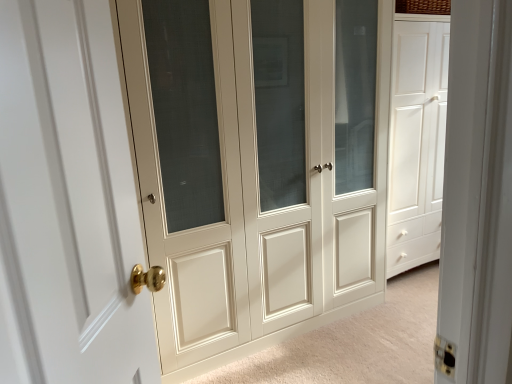
What is the approximate height of white glossy door at left, the 2th door viewed from the back?

white glossy door at left, the 2th door viewed from the back, is 95.21 centimeters in height.

Measure the distance between point (53, 136) and camera.

Point (53, 136) and camera are 25.43 inches apart.

What do you see at coordinates (67, 201) in the screenshot?
I see `white glossy door at left, marked as the first door in a front-to-back arrangement` at bounding box center [67, 201].

Where is `white glossy door at left, marked as the first door in a front-to-back arrangement`? white glossy door at left, marked as the first door in a front-to-back arrangement is located at coordinates (67, 201).

Describe the element at coordinates (258, 161) in the screenshot. Image resolution: width=512 pixels, height=384 pixels. I see `matte cream cabinet at center, which is the first door from back to front` at that location.

At what (x,y) coordinates should I click in order to perform the action: click on matte cream cabinet at center, which is the 1th door in right-to-left order. Please return your answer as a coordinate pair (x, y). Image resolution: width=512 pixels, height=384 pixels. Looking at the image, I should click on (258, 161).

Identify the location of white glossy door at left, marked as the first door in a front-to-back arrangement. (67, 201).

Is matte cream cabinet at center, the second door when ordered from left to right, at the left side of white glossy door at left, marked as the first door in a front-to-back arrangement?

No.

Which object is further away from the camera, matte cream cabinet at center, which is the second door from front to back, or white glossy door at left, which ranks as the 1th door in left-to-right order?

matte cream cabinet at center, which is the second door from front to back, is behind.

Is point (240, 157) closer or farther from the camera than point (110, 128)?

Point (240, 157) is positioned farther from the camera compared to point (110, 128).

In the scene shown: From the image's perspective, which is below, matte cream cabinet at center, which is the 1th door in right-to-left order, or white glossy door at left, acting as the second door starting from the right?

white glossy door at left, acting as the second door starting from the right, from the image's perspective.

From a real-world perspective, which object stands above the other?

In real-world perspective, white glossy door at left, acting as the second door starting from the right, is above.

Which of these two, matte cream cabinet at center, the second door when ordered from left to right, or white glossy door at left, the 2th door viewed from the back, is thinner?

With smaller width is white glossy door at left, the 2th door viewed from the back.

Who is shorter, matte cream cabinet at center, which is the first door from back to front, or white glossy door at left, acting as the second door starting from the right?

white glossy door at left, acting as the second door starting from the right.

Considering the sizes of matte cream cabinet at center, which is the first door from back to front, and white glossy door at left, marked as the first door in a front-to-back arrangement, in the image, is matte cream cabinet at center, which is the first door from back to front, bigger or smaller than white glossy door at left, marked as the first door in a front-to-back arrangement,?

In the image, matte cream cabinet at center, which is the first door from back to front, appears to be larger than white glossy door at left, marked as the first door in a front-to-back arrangement.

Do you think matte cream cabinet at center, which is the second door from front to back, is within white glossy door at left, marked as the first door in a front-to-back arrangement, or outside of it?

matte cream cabinet at center, which is the second door from front to back, cannot be found inside white glossy door at left, marked as the first door in a front-to-back arrangement.

Is matte cream cabinet at center, which is the 1th door in right-to-left order, not close to white glossy door at left, marked as the first door in a front-to-back arrangement?

Yes.

Looking at this image, is matte cream cabinet at center, the second door when ordered from left to right, oriented towards white glossy door at left, the 2th door viewed from the back?

Yes, matte cream cabinet at center, the second door when ordered from left to right, is turned towards white glossy door at left, the 2th door viewed from the back.

Can you tell me how much matte cream cabinet at center, which is the second door from front to back, and white glossy door at left, which ranks as the 1th door in left-to-right order, differ in facing direction?

56.3 degrees separate the facing orientations of matte cream cabinet at center, which is the second door from front to back, and white glossy door at left, which ranks as the 1th door in left-to-right order.

You are a GUI agent. You are given a task and a screenshot of the screen. Output one action in this format:
    pyautogui.click(x=<x>, y=<y>)
    Task: Click on the door that appears above the matte cream cabinet at center, the second door when ordered from left to right (from a real-world perspective)
    
    Given the screenshot: What is the action you would take?
    pyautogui.click(x=67, y=201)

Which is more to the right, white glossy door at left, which ranks as the 1th door in left-to-right order, or matte cream cabinet at center, the second door when ordered from left to right?

Positioned to the right is matte cream cabinet at center, the second door when ordered from left to right.

Between white glossy door at left, the 2th door viewed from the back, and matte cream cabinet at center, which is the 1th door in right-to-left order, which one is positioned in front?

white glossy door at left, the 2th door viewed from the back, is in front.

Is point (105, 326) closer to camera compared to point (140, 105)?

That is True.

From the image's perspective, is white glossy door at left, which ranks as the 1th door in left-to-right order, located above or below matte cream cabinet at center, which is the first door from back to front?

white glossy door at left, which ranks as the 1th door in left-to-right order, is below matte cream cabinet at center, which is the first door from back to front.

From a real-world perspective, is white glossy door at left, which ranks as the 1th door in left-to-right order, on top of matte cream cabinet at center, which is the 1th door in right-to-left order?

Yes, from a real-world perspective, white glossy door at left, which ranks as the 1th door in left-to-right order, is on top of matte cream cabinet at center, which is the 1th door in right-to-left order.

Is white glossy door at left, acting as the second door starting from the right, wider or thinner than matte cream cabinet at center, which is the 1th door in right-to-left order?

white glossy door at left, acting as the second door starting from the right, is thinner than matte cream cabinet at center, which is the 1th door in right-to-left order.

Considering the relative sizes of white glossy door at left, which ranks as the 1th door in left-to-right order, and matte cream cabinet at center, the second door when ordered from left to right, in the image provided, is white glossy door at left, which ranks as the 1th door in left-to-right order, taller than matte cream cabinet at center, the second door when ordered from left to right,?

No, white glossy door at left, which ranks as the 1th door in left-to-right order, is not taller than matte cream cabinet at center, the second door when ordered from left to right.

Looking at the image, does white glossy door at left, the 2th door viewed from the back, seem bigger or smaller compared to matte cream cabinet at center, which is the second door from front to back?

Clearly, white glossy door at left, the 2th door viewed from the back, is smaller in size than matte cream cabinet at center, which is the second door from front to back.

Is matte cream cabinet at center, which is the 1th door in right-to-left order, a part of white glossy door at left, the 2th door viewed from the back?

No, white glossy door at left, the 2th door viewed from the back, does not contain matte cream cabinet at center, which is the 1th door in right-to-left order.

Is white glossy door at left, marked as the first door in a front-to-back arrangement, placed right next to matte cream cabinet at center, which is the first door from back to front?

white glossy door at left, marked as the first door in a front-to-back arrangement, and matte cream cabinet at center, which is the first door from back to front, are not in contact.

Is white glossy door at left, marked as the first door in a front-to-back arrangement, oriented away from matte cream cabinet at center, which is the 1th door in right-to-left order?

That's not correct — white glossy door at left, marked as the first door in a front-to-back arrangement, is not looking away from matte cream cabinet at center, which is the 1th door in right-to-left order.

Looking at this image, how different are the orientations of white glossy door at left, acting as the second door starting from the right, and matte cream cabinet at center, which is the first door from back to front, in degrees?

They differ by 56.3 degrees in their facing directions.

Identify the location of door behind the white glossy door at left, which ranks as the 1th door in left-to-right order. (258, 161).

Locate an element on the screen. The height and width of the screenshot is (384, 512). door above the white glossy door at left, marked as the first door in a front-to-back arrangement (from the image's perspective) is located at coordinates (258, 161).

You are a GUI agent. You are given a task and a screenshot of the screen. Output one action in this format:
    pyautogui.click(x=<x>, y=<y>)
    Task: Click on the door to the right of white glossy door at left, the 2th door viewed from the back
    
    Given the screenshot: What is the action you would take?
    pyautogui.click(x=258, y=161)